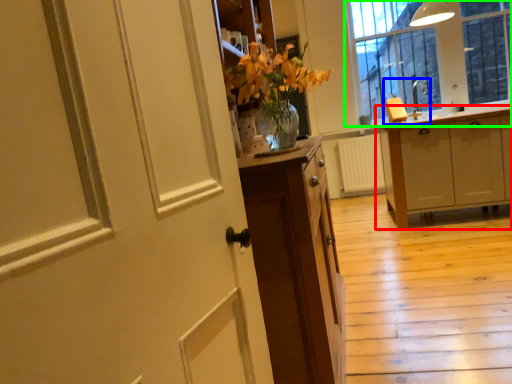
Question: Estimate the real-world distances between objects in this image. Which object is farther from cabinetry (highlighted by a red box), sink (highlighted by a blue box) or window (highlighted by a green box)?

Choices:
 (A) sink
 (B) window

Answer: (B)